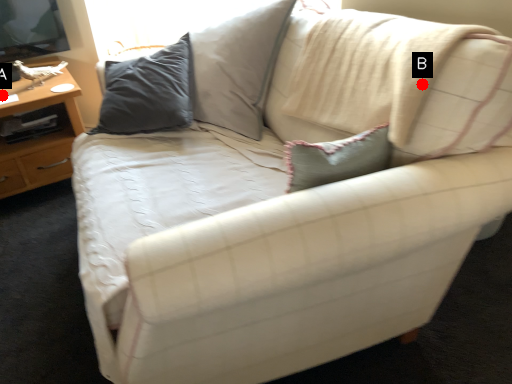
Question: Two points are circled on the image, labeled by A and B beside each circle. Among these points, which one is farthest from the camera?

Choices:
 (A) A is further
 (B) B is further

Answer: (A)